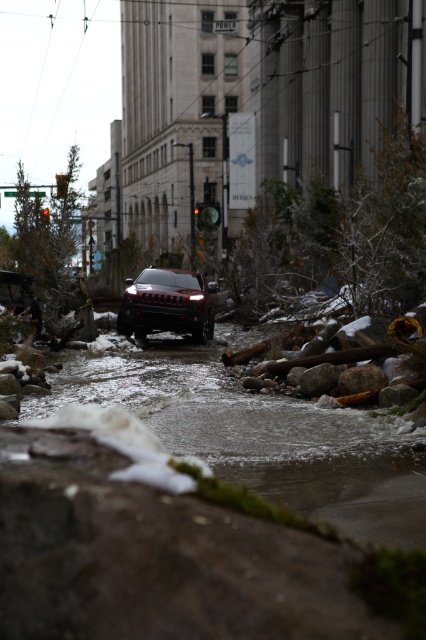
Who is more distant from viewer, (290, 448) or (149, 280)?

The point (149, 280) is behind.

Can you confirm if clear ice water at center is bigger than shiny black suv at center?

Yes, clear ice water at center is bigger than shiny black suv at center.

Is point (221, 330) closer to camera compared to point (169, 310)?

No, (221, 330) is behind (169, 310).

Image resolution: width=426 pixels, height=640 pixels. Identify the location of clear ice water at center. (258, 435).